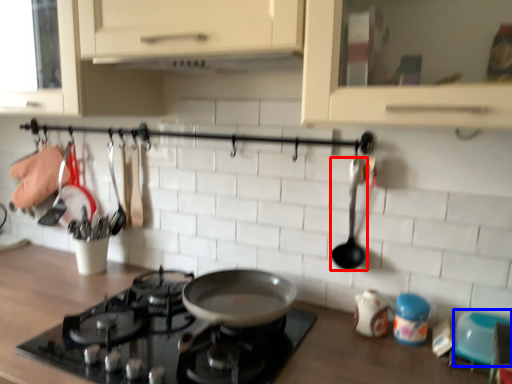
Question: Which object is closer to the camera taking this photo, spoon (highlighted by a red box) or appliance (highlighted by a blue box)?

Choices:
 (A) spoon
 (B) appliance

Answer: (B)